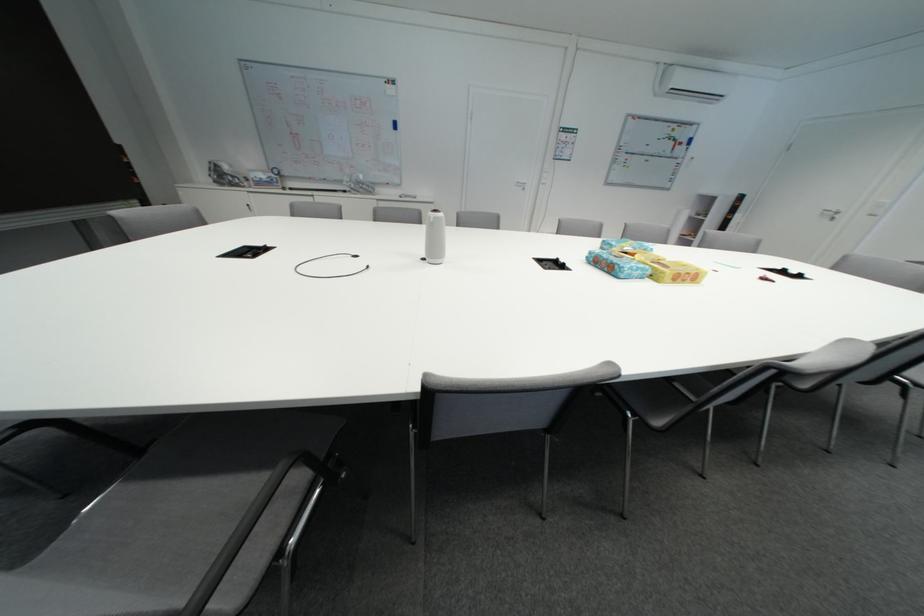
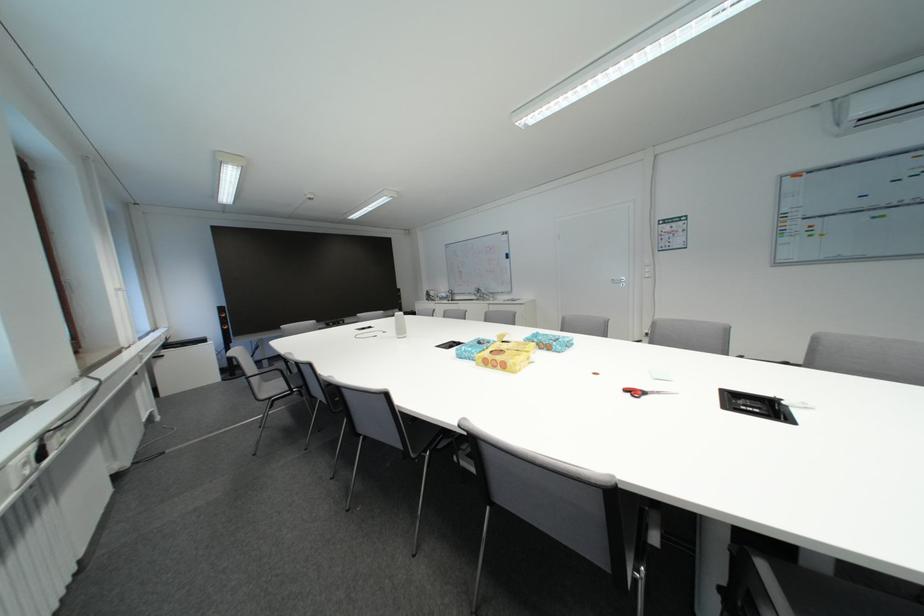
In the second image, find the point that corresponds to point 694,283 in the first image.

(505, 370)